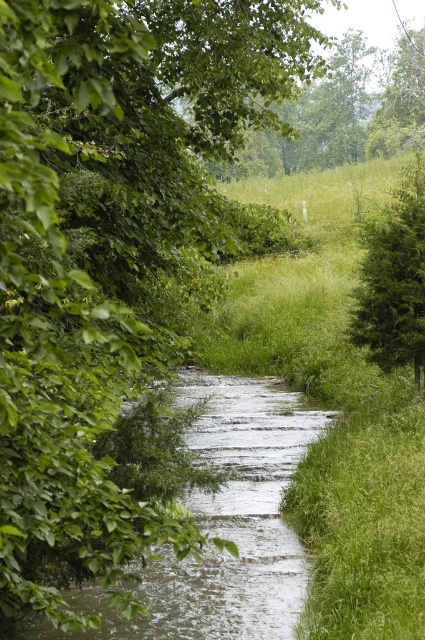
Question: Among these points, which one is nearest to the camera?

Choices:
 (A) (393, 109)
 (B) (249, 592)

Answer: (B)

Question: Which is farther from the clear water at center?

Choices:
 (A) green leafy tree at upper center
 (B) green textured tree at right

Answer: (A)

Question: Which object is closer to the camera taking this photo?

Choices:
 (A) green textured tree at right
 (B) clear water at center

Answer: (B)

Question: Does green leafy tree at upper center appear on the left side of green textured tree at right?

Choices:
 (A) yes
 (B) no

Answer: (A)

Question: Can you confirm if clear water at center is thinner than green leafy tree at upper center?

Choices:
 (A) no
 (B) yes

Answer: (B)

Question: Is clear water at center positioned in front of green leafy tree at upper center?

Choices:
 (A) no
 (B) yes

Answer: (B)